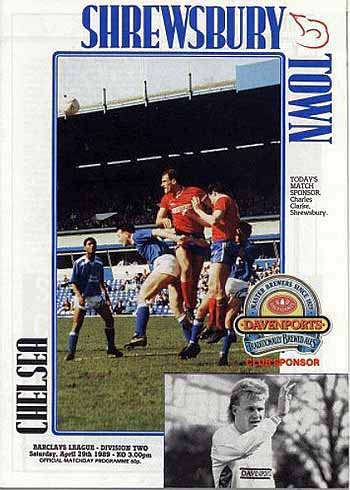
I want to click on blue sock, so click(x=70, y=346), click(x=108, y=333), click(x=141, y=314), click(x=188, y=333), click(x=194, y=328), click(x=223, y=343).